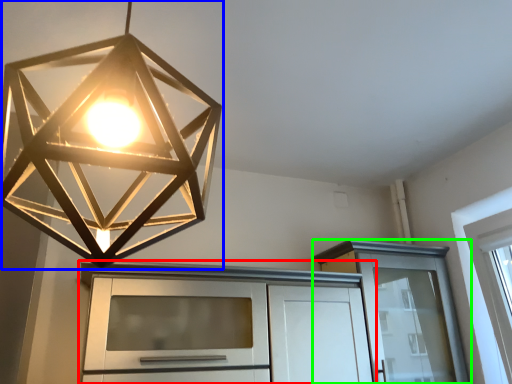
Question: Which object is positioned closest to cabinetry (highlighted by a red box)? Select from lamp (highlighted by a blue box) and cabinetry (highlighted by a green box).

Choices:
 (A) lamp
 (B) cabinetry

Answer: (B)